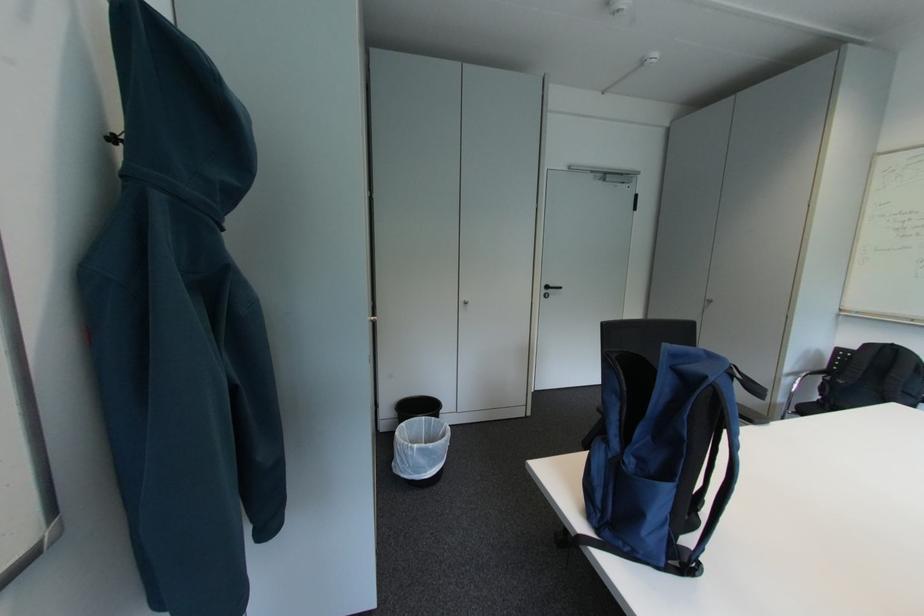
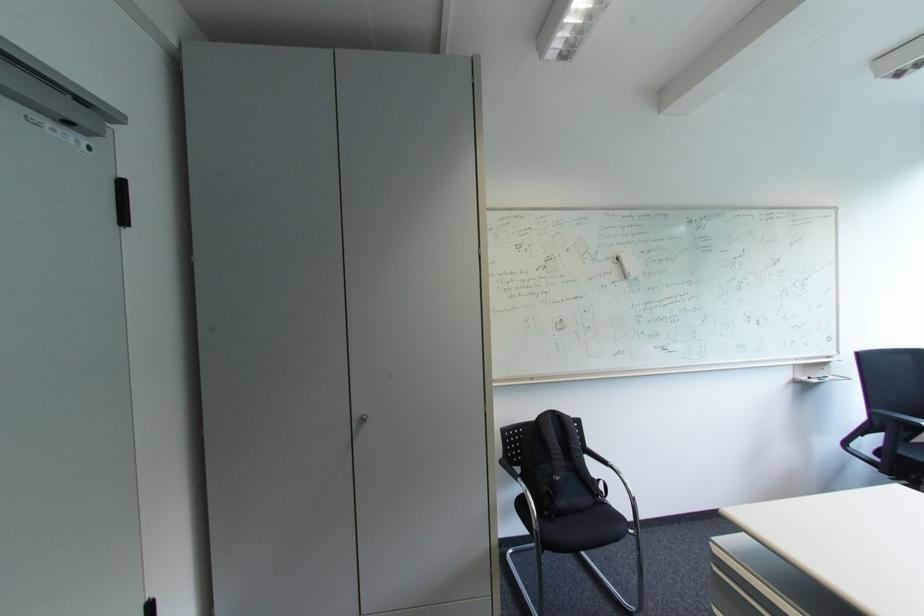
The point at (850, 384) is marked in the first image. Where is the corresponding point in the second image?

(566, 480)